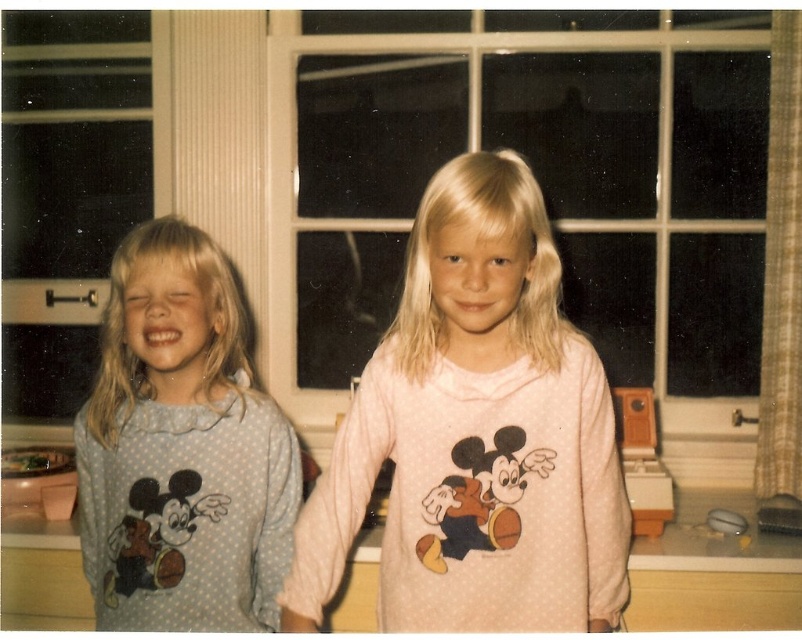
From the picture: You are a delivery robot with a height of 1.8 meters. You need to deliver a package to the clear glass window at center. Can you reach the window without any assistance?

The clear glass window at center is 1.93 meters away from the camera. Since the robot is 1.8 meters tall, it cannot reach the window without assistance as the distance is greater than its height.

You are a photographer trying to capture a photo of the clear glass window at center and the pink soft fabric shirt at center. Which object should you focus on first if you want to ensure both are in the frame without moving the camera?

The clear glass window at center is positioned on the right side of the pink soft fabric shirt at center, so you should focus on the pink soft fabric shirt at center first to ensure both are in the frame.

You are a fashion designer looking at two clothing items in the image. The pink soft fabric shirt at center and the light blue dotted pajamas at left. Which one is positioned to the right side of the other?

The pink soft fabric shirt at center is positioned to the right of the light blue dotted pajamas at left according to the description.